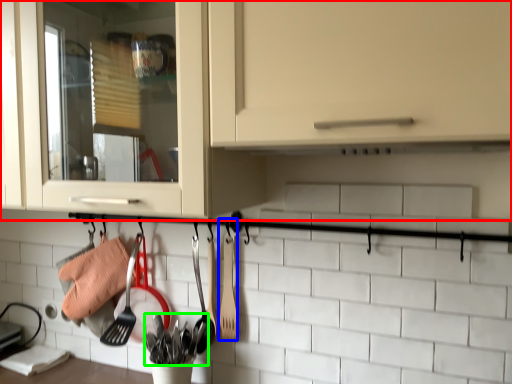
Question: Estimate the real-world distances between objects in this image. Which object is closer to cabinetry (highlighted by a red box), spatula (highlighted by a blue box) or silverware (highlighted by a green box)?

Choices:
 (A) spatula
 (B) silverware

Answer: (A)